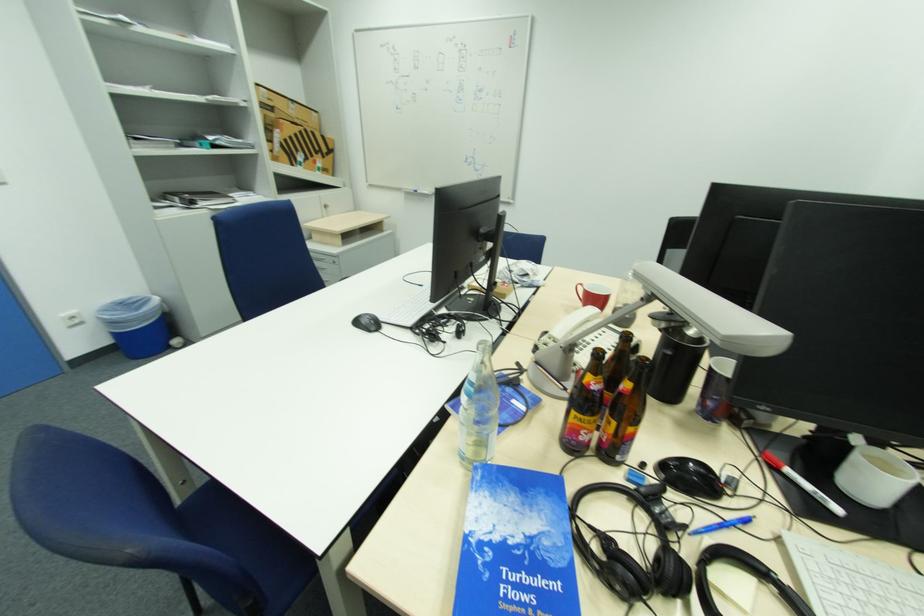
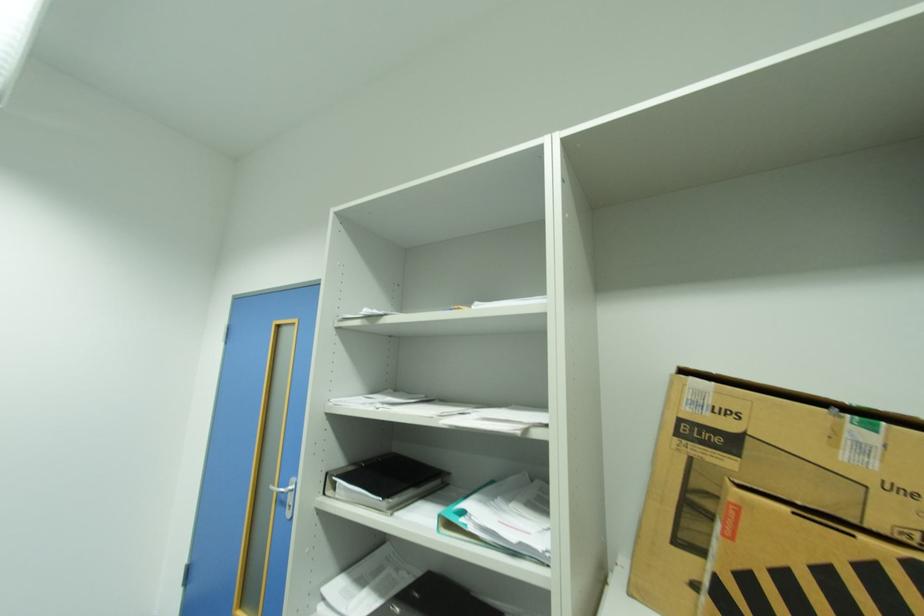
The point at (274,124) is marked in the first image. Where is the corresponding point in the second image?

(700, 487)